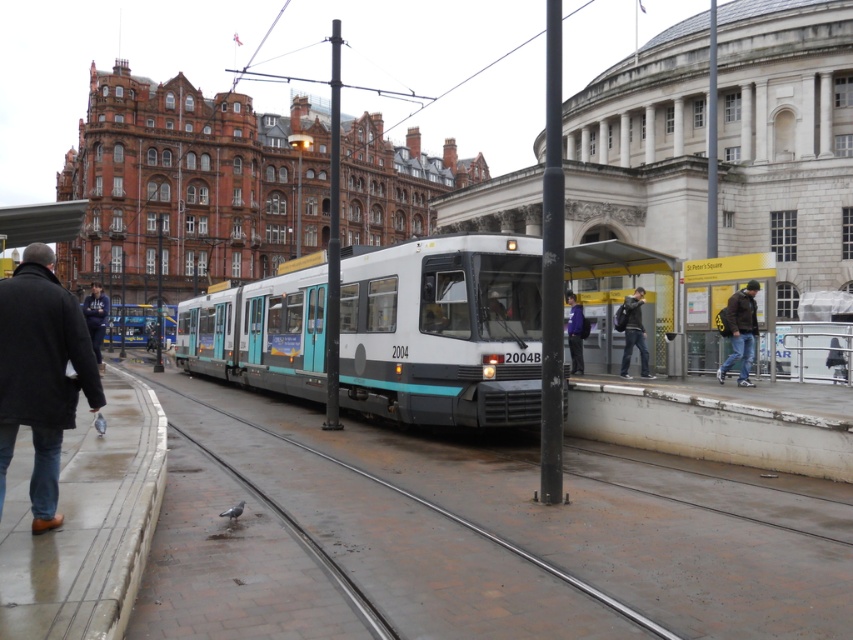
The image size is (853, 640). What are the coordinates of `dark blue hoodie at left` in the screenshot? It's located at (x=96, y=317).

Between dark blue hoodie at left and purple fabric jacket at center, which one appears on the left side from the viewer's perspective?

dark blue hoodie at left

In order to click on dark blue hoodie at left in this screenshot , I will do `click(96, 317)`.

Between matte black backpack at right and dark brown leather jacket at right, which one is positioned higher?

matte black backpack at right is higher up.

Is matte black backpack at right thinner than dark brown leather jacket at right?

In fact, matte black backpack at right might be wider than dark brown leather jacket at right.

Who is more forward, (679, 278) or (740, 340)?

Point (740, 340)

This screenshot has height=640, width=853. I want to click on matte black backpack at right, so coord(721,301).

Can you confirm if metallic bus stop at right is positioned to the right of dark gray backpack at center?

Incorrect, metallic bus stop at right is not on the right side of dark gray backpack at center.

Can you confirm if metallic bus stop at right is shorter than dark gray backpack at center?

No, metallic bus stop at right is not shorter than dark gray backpack at center.

Between point (589, 259) and point (624, 358), which one is positioned behind?

The point (589, 259) is more distant.

At what (x,y) coordinates should I click in order to perform the action: click on metallic bus stop at right. Please return your answer as a coordinate pair (x, y). Looking at the image, I should click on (624, 292).